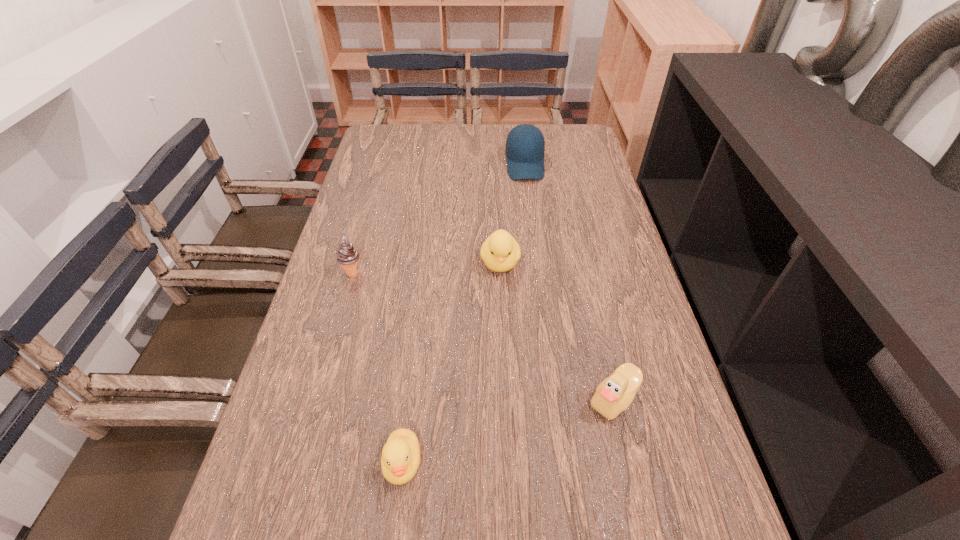
Find the location of a particular element. object that can be found as the second closest to the second farthest duck is located at coordinates (400, 459).

At what (x,y) coordinates should I click in order to perform the action: click on the third closest object to the second duck from right to left. Please return your answer as a coordinate pair (x, y). This screenshot has width=960, height=540. Looking at the image, I should click on (347, 255).

Select which duck is the closest to the icecream. Please provide its 2D coordinates. Your answer should be formatted as a tuple, i.e. [(x, y)], where the tuple contains the x and y coordinates of a point satisfying the conditions above.

[(500, 252)]

The width and height of the screenshot is (960, 540). In order to click on duck that is the second closest to the second nearest object in this screenshot , I will do `click(400, 459)`.

Locate an element on the screen. blank space that satisfies the following two spatial constraints: 1. at the beak of the second farthest duck; 2. at the beak of the leftmost duck is located at coordinates (629, 463).